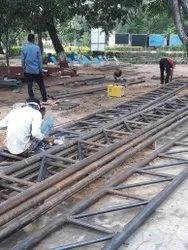
Locate an element on the screen. The width and height of the screenshot is (188, 250). wall is located at coordinates (140, 39).